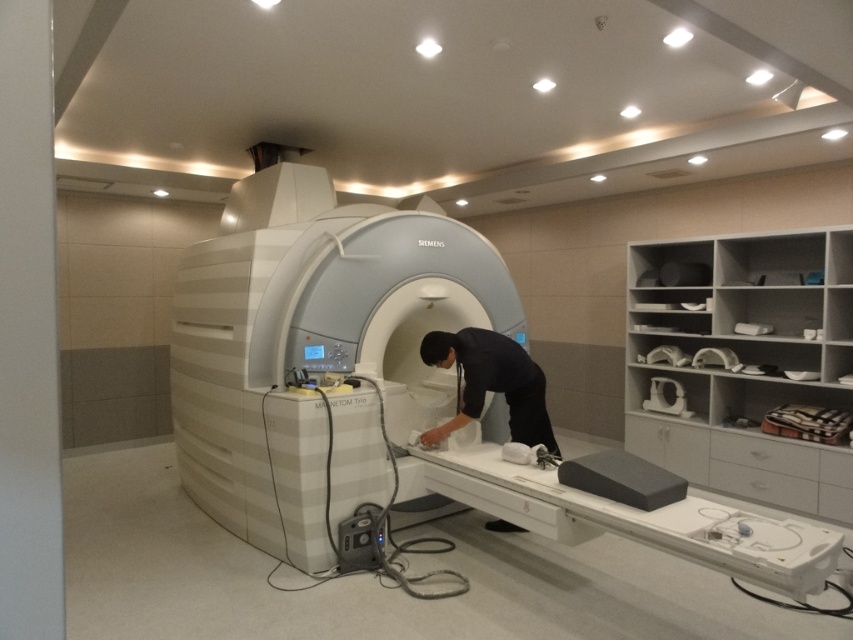
You are a technician in the medical imaging room. You need to determine the relative height between the white plastic mri machine at center and the black fabric at center. Based on the scene, which object is taller?

The white plastic mri machine at center is taller than the black fabric at center according to the description.

You are standing at the point marked at (331, 307) in the image. The MRI machine is 11.93 feet away from you. Can you reach the control panel on the MRI machine from your current position without moving closer?

The control panel on the MRI machine is 11.93 feet away from your current position at point (331, 307). Since the control panel is part of the MRI machine itself, you would need to move closer to reach it, so you cannot reach it without moving closer.

You are a technician in the MRI room. You need to place a small sensor at point A and point B. Point A is at coordinate point(316, 328) and point B is at coordinate point(514, 403). From your vantage point, which point is closer to you?

Point A at coordinate point(316, 328) is closer to you because it is in front of point B at coordinate point(514, 403).